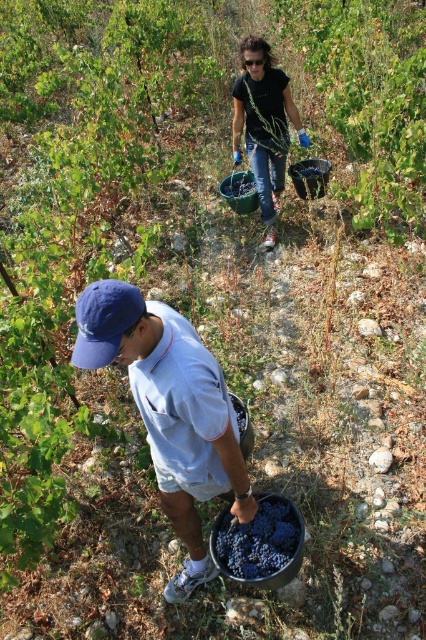
Which is more to the left, black t-shirt at upper center or dark purple grapes at lower center?

From the viewer's perspective, dark purple grapes at lower center appears more on the left side.

Is point (250, 48) closer to camera compared to point (259, 570)?

That is False.

Does point (264, 77) come closer to viewer compared to point (299, 536)?

No, (264, 77) is behind (299, 536).

Find the location of a particular element. Image resolution: width=426 pixels, height=640 pixels. black t-shirt at upper center is located at coordinates (264, 124).

Is blue fabric cap at lower left wider than dark purple grapes at lower center?

Yes, blue fabric cap at lower left is wider than dark purple grapes at lower center.

Does point (140, 404) come closer to viewer compared to point (288, 534)?

Yes, it is in front of point (288, 534).

The height and width of the screenshot is (640, 426). Find the location of `blue fabric cap at lower left`. blue fabric cap at lower left is located at coordinates (169, 410).

Between blue fabric cap at lower left and black t-shirt at upper center, which one appears on the right side from the viewer's perspective?

black t-shirt at upper center

Looking at this image, measure the distance between point (140, 403) and camera.

7.22 feet

Image resolution: width=426 pixels, height=640 pixels. What do you see at coordinates (169, 410) in the screenshot?
I see `blue fabric cap at lower left` at bounding box center [169, 410].

The width and height of the screenshot is (426, 640). Identify the location of blue fabric cap at lower left. [169, 410].